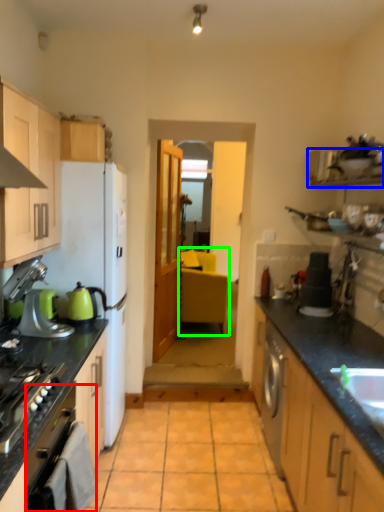
Question: Which object is positioned closest to oven (highlighted by a red box)? Select from shelf (highlighted by a blue box) and chair (highlighted by a green box).

Choices:
 (A) shelf
 (B) chair

Answer: (A)